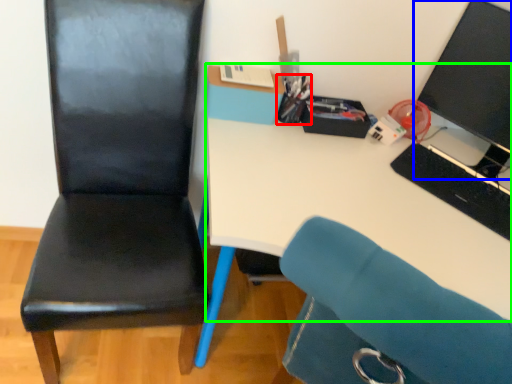
Question: Based on their relative distances, which object is farther from stationery (highlighted by a red box)? Choose from computer monitor (highlighted by a blue box) and desk (highlighted by a green box).

Choices:
 (A) computer monitor
 (B) desk

Answer: (A)